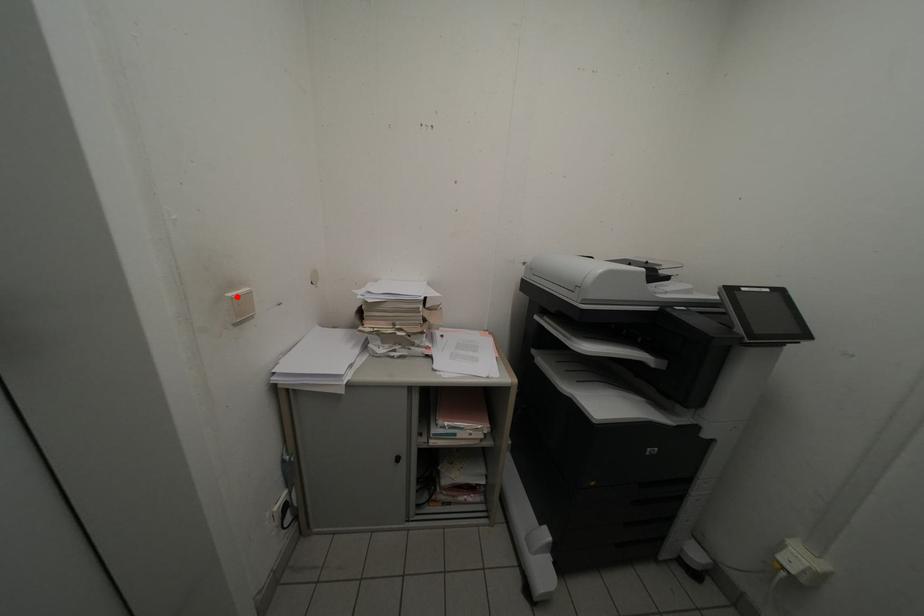
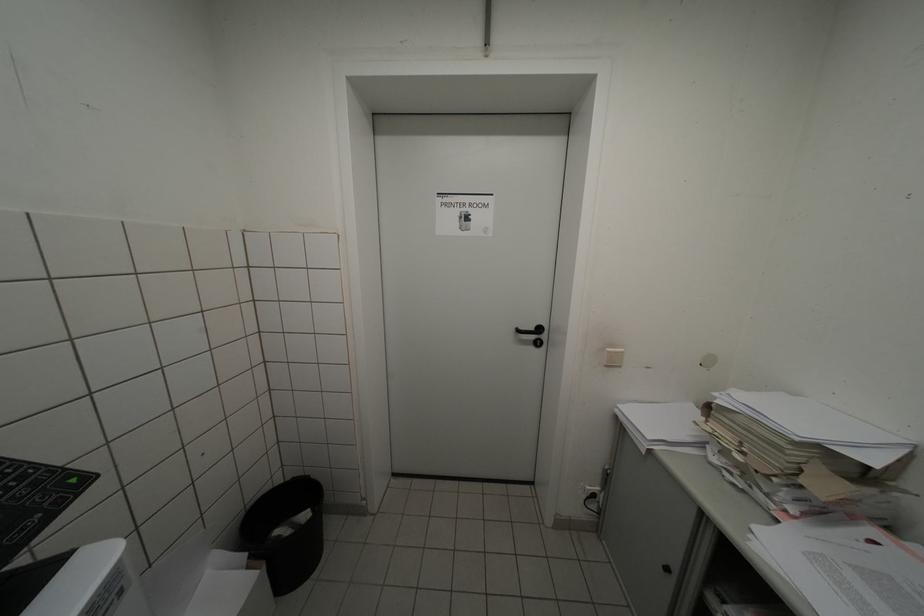
The point at the highlighted location is marked in the first image. Where is the corresponding point in the second image?

(615, 352)